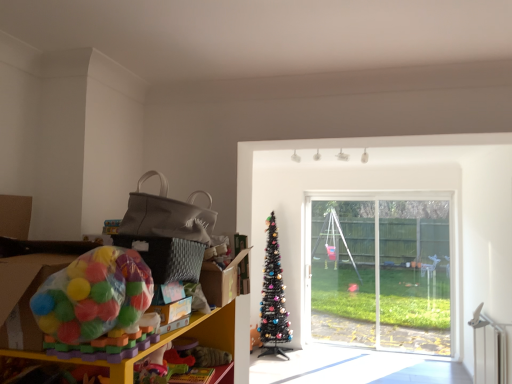
Question: Considering their positions, is translucent plastic ball pit at left located in front of or behind plastic toy at left?

Choices:
 (A) behind
 (B) front

Answer: (B)

Question: From a real-world perspective, is translucent plastic ball pit at left physically located above or below plastic toy at left?

Choices:
 (A) above
 (B) below

Answer: (A)

Question: Which is farther from the plastic toy at left?

Choices:
 (A) transparent glass window at center
 (B) translucent plastic ball pit at left
 (C) black artificial christmas tree at center

Answer: (A)

Question: Estimate the real-world distances between objects in this image. Which object is farther from the plastic toy at left?

Choices:
 (A) transparent glass window at center
 (B) translucent plastic ball pit at left
 (C) black artificial christmas tree at center

Answer: (A)